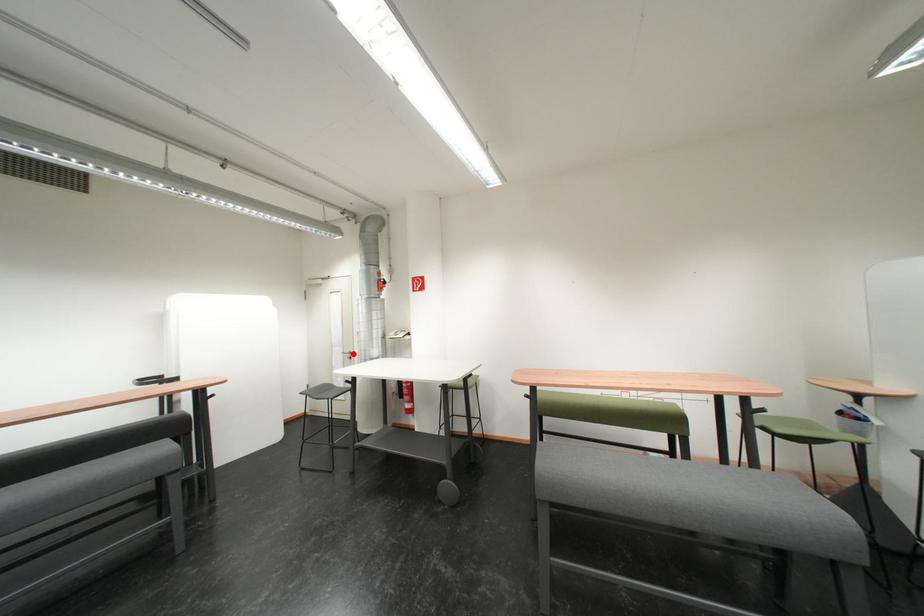
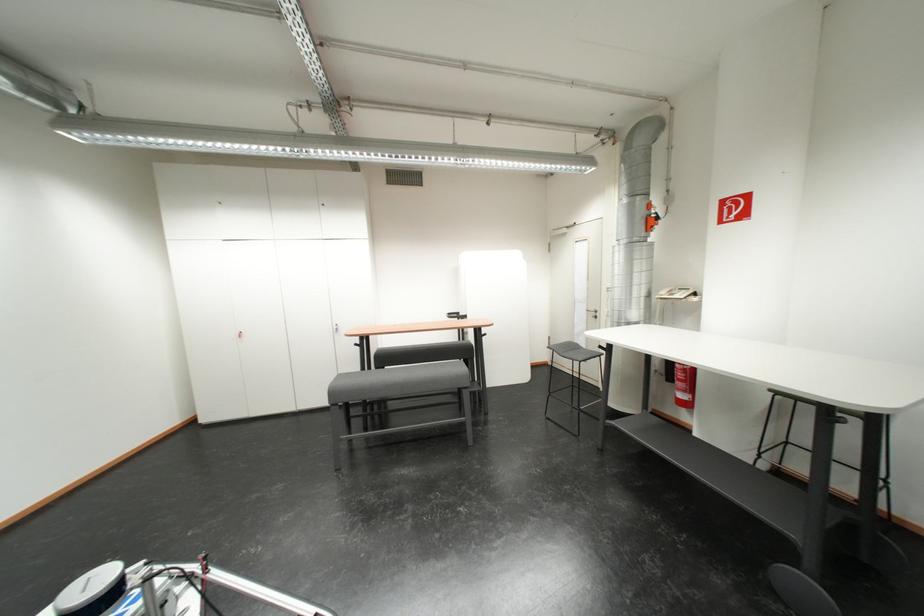
Locate, in the second image, the point that corresponds to the highlighted location in the first image.

(597, 310)